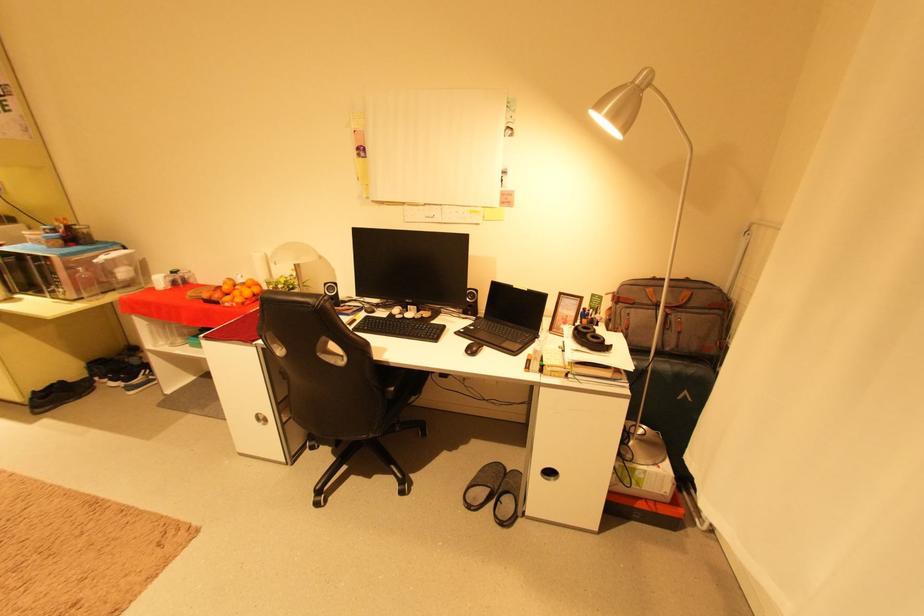
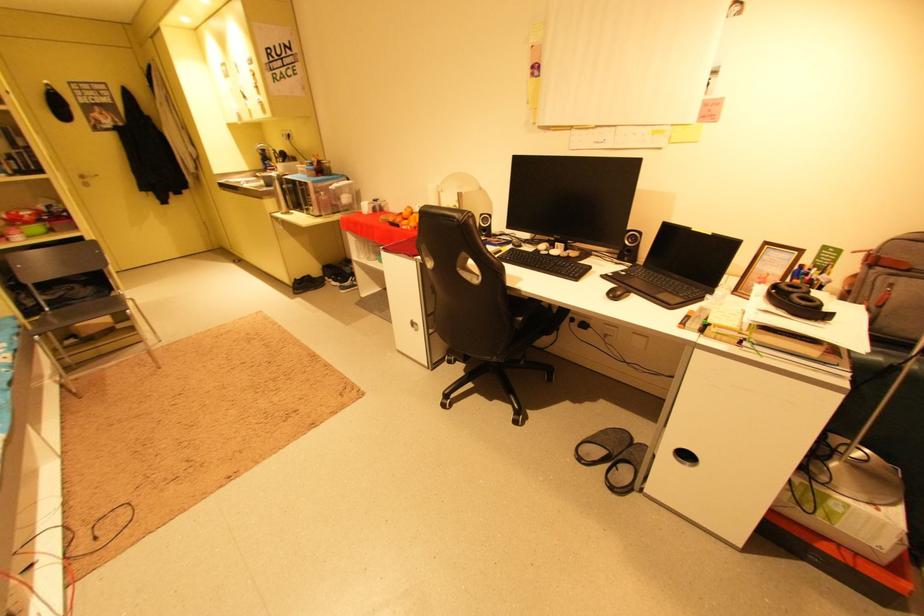
Locate, in the second image, the point that corresponds to [235,305] in the first image.

(410, 228)